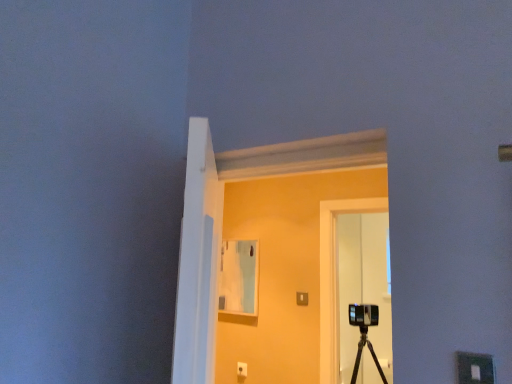
The width and height of the screenshot is (512, 384). What do you see at coordinates (269, 245) in the screenshot?
I see `transparent glass door at center` at bounding box center [269, 245].

This screenshot has width=512, height=384. I want to click on transparent glass door at center, so click(x=269, y=245).

Locate an element on the screen. Image resolution: width=512 pixels, height=384 pixels. transparent glass door at center is located at coordinates (362, 286).

Describe the element at coordinates (362, 286) in the screenshot. I see `transparent glass door at center` at that location.

Where is `transparent glass door at center`? transparent glass door at center is located at coordinates (269, 245).

In the image, is transparent glass door at center on the left side or the right side of transparent glass door at center?

In the image, transparent glass door at center appears on the left side of transparent glass door at center.

Does transparent glass door at center come behind transparent glass door at center?

No, the depth of transparent glass door at center is less than that of transparent glass door at center.

Is point (308, 159) positioned after point (341, 321)?

No.

From the image's perspective, is transparent glass door at center beneath transparent glass door at center?

No.

From a real-world perspective, is transparent glass door at center located beneath transparent glass door at center?

Incorrect, from a real-world perspective, transparent glass door at center is higher than transparent glass door at center.

Is transparent glass door at center thinner than transparent glass door at center?

No, transparent glass door at center is not thinner than transparent glass door at center.

Is transparent glass door at center taller than transparent glass door at center?

No.

Considering the sizes of transparent glass door at center and transparent glass door at center in the image, is transparent glass door at center bigger or smaller than transparent glass door at center?

transparent glass door at center is bigger than transparent glass door at center.

Is transparent glass door at center inside the boundaries of transparent glass door at center, or outside?

transparent glass door at center is not enclosed by transparent glass door at center.

Would you say transparent glass door at center is a long distance from transparent glass door at center?

Yes, transparent glass door at center is far from transparent glass door at center.

Is transparent glass door at center oriented towards transparent glass door at center?

Yes, transparent glass door at center is turned towards transparent glass door at center.

How many degrees apart are the facing directions of transparent glass door at center and transparent glass door at center?

There is a 178-degree angle between the facing directions of transparent glass door at center and transparent glass door at center.

Locate an element on the screen. Image resolution: width=512 pixels, height=384 pixels. glass door to the right of transparent glass door at center is located at coordinates (362, 286).

Between transparent glass door at center and transparent glass door at center, which one appears on the left side from the viewer's perspective?

From the viewer's perspective, transparent glass door at center appears more on the left side.

Is the depth of transparent glass door at center greater than that of transparent glass door at center?

Yes, it is.

Is point (384, 354) closer to camera compared to point (313, 242)?

No, (384, 354) is further to viewer.

From the image's perspective, is transparent glass door at center located above or below transparent glass door at center?

transparent glass door at center is below transparent glass door at center.

From a real-world perspective, between transparent glass door at center and transparent glass door at center, who is vertically higher?

transparent glass door at center, from a real-world perspective.

Considering the sizes of objects transparent glass door at center and transparent glass door at center in the image provided, who is wider, transparent glass door at center or transparent glass door at center?

transparent glass door at center.

Which of these two, transparent glass door at center or transparent glass door at center, stands shorter?

transparent glass door at center.

Is transparent glass door at center bigger or smaller than transparent glass door at center?

In the image, transparent glass door at center appears to be smaller than transparent glass door at center.

Is transparent glass door at center completely or partially inside transparent glass door at center?

Definitely not — transparent glass door at center is not inside transparent glass door at center.

Are transparent glass door at center and transparent glass door at center beside each other?

They are not placed beside each other.

Looking at this image, is transparent glass door at center at the back of transparent glass door at center?

No, transparent glass door at center is not facing away from transparent glass door at center.

What's the angular difference between transparent glass door at center and transparent glass door at center's facing directions?

They differ by 178 degrees in their facing directions.

Measure the distance from transparent glass door at center to transparent glass door at center.

transparent glass door at center and transparent glass door at center are 1.74 meters apart.

Image resolution: width=512 pixels, height=384 pixels. Find the location of `glass door directly beneath the transparent glass door at center (from a real-world perspective)`. glass door directly beneath the transparent glass door at center (from a real-world perspective) is located at coordinates (362, 286).

Where is `window in front of the transparent glass door at center`? The height and width of the screenshot is (384, 512). window in front of the transparent glass door at center is located at coordinates (269, 245).

The height and width of the screenshot is (384, 512). I want to click on glass door that appears below the transparent glass door at center (from the image's perspective), so click(x=362, y=286).